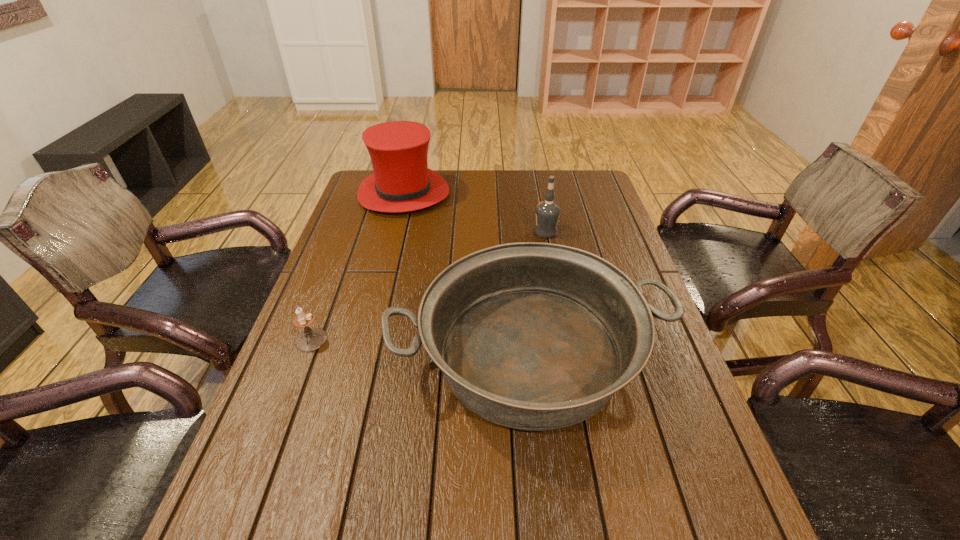
The image size is (960, 540). I want to click on vacant area that lies between the hat and the shortest object, so click(x=357, y=267).

At what (x,y) coordinates should I click in order to perform the action: click on free space between the second farthest object and the candle holder. Please return your answer as a coordinate pair (x, y). This screenshot has height=540, width=960. Looking at the image, I should click on (428, 286).

Identify the location of blank region between the vodka and the farthest object. (474, 213).

In order to click on free space between the farthest object and the second farthest object in this screenshot , I will do `click(474, 213)`.

Identify the location of empty space between the vodka and the hat. (474, 213).

Where is `empty location between the hat and the third nearest object`? The width and height of the screenshot is (960, 540). empty location between the hat and the third nearest object is located at coordinates (474, 213).

Find the location of a particular element. The height and width of the screenshot is (540, 960). free space between the candle holder and the second farthest object is located at coordinates (428, 286).

Identify which object is the second nearest to the farthest object. Please provide its 2D coordinates. Your answer should be formatted as a tuple, i.e. [(x, y)], where the tuple contains the x and y coordinates of a point satisfying the conditions above.

[(533, 336)]

Where is `the closest object to the shortest object`? The width and height of the screenshot is (960, 540). the closest object to the shortest object is located at coordinates (533, 336).

Locate an element on the screen. The image size is (960, 540). blank space that satisfies the following two spatial constraints: 1. on the front label of the vodka; 2. on the front side of the shortest object is located at coordinates (566, 340).